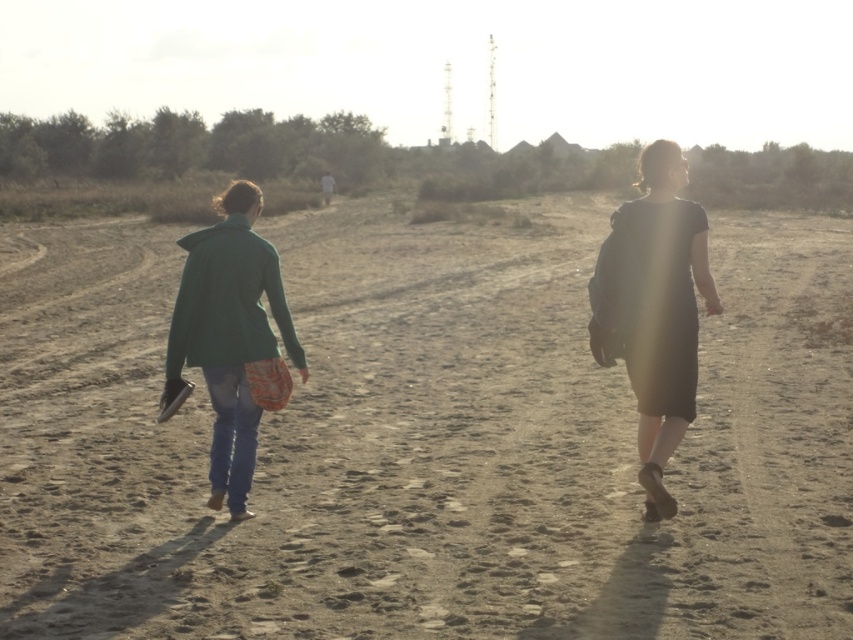
Between matte black dress at right and green matte jacket at left, which one has more height?

matte black dress at right is taller.

Between point (628, 376) and point (225, 193), which one is positioned in front?

Point (225, 193) is in front.

Identify the location of matte black dress at right. (654, 308).

Which is behind, point (662, 307) or point (633, 225)?

Positioned behind is point (633, 225).

Is point (665, 220) positioned behind point (670, 150)?

No.

The width and height of the screenshot is (853, 640). Describe the element at coordinates (654, 308) in the screenshot. I see `green fabric jacket at left` at that location.

You are a GUI agent. You are given a task and a screenshot of the screen. Output one action in this format:
    pyautogui.click(x=<x>, y=<y>)
    Task: Click on the green fabric jacket at left
    The height and width of the screenshot is (640, 853).
    Given the screenshot: What is the action you would take?
    pyautogui.click(x=654, y=308)

At what (x,y) coordinates should I click in order to perform the action: click on brown sandy dirt at center. Please return your answer as a coordinate pair (x, y). Image resolution: width=853 pixels, height=640 pixels. Looking at the image, I should click on 426,440.

Which is behind, point (67, 531) or point (682, 280)?

The point (682, 280) is more distant.

Which is in front, point (523, 412) or point (676, 186)?

Positioned in front is point (676, 186).

The height and width of the screenshot is (640, 853). Identify the location of brown sandy dirt at center. (426, 440).